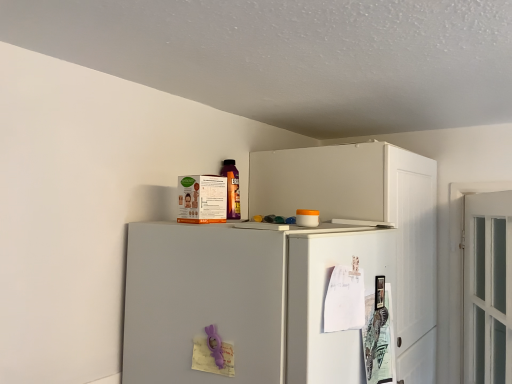
You are a GUI agent. You are given a task and a screenshot of the screen. Output one action in this format:
    pyautogui.click(x=<x>, y=<y>)
    Task: Click on the white glass door at right, which appears as the second door when viewed from the left
    This screenshot has width=512, height=384.
    Given the screenshot: What is the action you would take?
    coord(488,288)

Based on the photo, what is the approximate height of white glass door at right, the first door viewed from the right?

white glass door at right, the first door viewed from the right, is 31.31 inches tall.

This screenshot has height=384, width=512. Describe the element at coordinates (369, 222) in the screenshot. I see `white matte cabinet at upper right` at that location.

Image resolution: width=512 pixels, height=384 pixels. I want to click on white matte cabinet at upper right, so click(369, 222).

This screenshot has width=512, height=384. What do you see at coordinates (257, 302) in the screenshot?
I see `white matte refrigerator at upper center` at bounding box center [257, 302].

This screenshot has width=512, height=384. In order to click on white glass door at right, which appears as the second door when viewed from the left in this screenshot , I will do `click(488, 288)`.

Is white matte refrigerator at upper center in front of or behind white paper at upper right, the 2th door viewed from the right, in the image?

In the image, white matte refrigerator at upper center appears in front of white paper at upper right, the 2th door viewed from the right.

Based on the photo, is white matte refrigerator at upper center bigger or smaller than white paper at upper right, placed as the 1th door when sorted from left to right?

Considering their sizes, white matte refrigerator at upper center takes up more space than white paper at upper right, placed as the 1th door when sorted from left to right.

Considering the positions of objects white matte refrigerator at upper center and white paper at upper right, the 2th door viewed from the right, in the image provided, who is more to the right, white matte refrigerator at upper center or white paper at upper right, the 2th door viewed from the right,?

Positioned to the right is white paper at upper right, the 2th door viewed from the right.

From a real-world perspective, starting from the white matte refrigerator at upper center, which door is the 2nd one vertically above it? Please provide its 2D coordinates.

[(339, 307)]

From a real-world perspective, between white paper at upper right, placed as the 1th door when sorted from left to right, and white matte refrigerator at upper center, who is vertically lower?

From a 3D spatial view, white matte refrigerator at upper center is below.

Measure the distance from white paper at upper right, the 2th door viewed from the right, to white matte refrigerator at upper center.

A distance of 4.33 inches exists between white paper at upper right, the 2th door viewed from the right, and white matte refrigerator at upper center.

Is white paper at upper right, placed as the 1th door when sorted from left to right, in contact with white matte refrigerator at upper center?

No, white paper at upper right, placed as the 1th door when sorted from left to right, is not making contact with white matte refrigerator at upper center.

You are a GUI agent. You are given a task and a screenshot of the screen. Output one action in this format:
    pyautogui.click(x=<x>, y=<y>)
    Task: Click on the door behind the white paper at upper right, placed as the 1th door when sorted from left to right
    
    Given the screenshot: What is the action you would take?
    [x=488, y=288]

Considering the relative sizes of white paper at upper right, placed as the 1th door when sorted from left to right, and white glass door at right, the first door viewed from the right, in the image provided, is white paper at upper right, placed as the 1th door when sorted from left to right, wider than white glass door at right, the first door viewed from the right,?

No, white paper at upper right, placed as the 1th door when sorted from left to right, is not wider than white glass door at right, the first door viewed from the right.

Is white paper at upper right, placed as the 1th door when sorted from left to right, touching white glass door at right, the first door viewed from the right?

No, white paper at upper right, placed as the 1th door when sorted from left to right, is not beside white glass door at right, the first door viewed from the right.

Are white glass door at right, which appears as the second door when viewed from the left, and white paper at upper right, the 2th door viewed from the right, located far from each other?

white glass door at right, which appears as the second door when viewed from the left, is actually quite close to white paper at upper right, the 2th door viewed from the right.

Could you tell me if white glass door at right, the first door viewed from the right, is turned towards white paper at upper right, the 2th door viewed from the right?

No.

Which is behind, white glass door at right, the first door viewed from the right, or white paper at upper right, the 2th door viewed from the right?

white glass door at right, the first door viewed from the right.

Is white paper at upper right, placed as the 1th door when sorted from left to right, inside the boundaries of white matte cabinet at upper right, or outside?

white paper at upper right, placed as the 1th door when sorted from left to right, cannot be found inside white matte cabinet at upper right.

From the image's perspective, would you say white paper at upper right, the 2th door viewed from the right, is shown under white matte cabinet at upper right?

No, from the image's perspective, white paper at upper right, the 2th door viewed from the right, is not below white matte cabinet at upper right.

Is point (302, 354) positioned before point (344, 215)?

Yes, point (302, 354) is in front of point (344, 215).

Between white paper at upper right, the 2th door viewed from the right, and white matte cabinet at upper right, which one has smaller size?

white paper at upper right, the 2th door viewed from the right.

Would you say white matte cabinet at upper right is inside or outside white paper at upper right, placed as the 1th door when sorted from left to right?

white matte cabinet at upper right cannot be found inside white paper at upper right, placed as the 1th door when sorted from left to right.

Can you confirm if white matte cabinet at upper right is wider than white paper at upper right, the 2th door viewed from the right?

Yes.

Between white matte cabinet at upper right and white paper at upper right, the 2th door viewed from the right, which one appears on the right side from the viewer's perspective?

→ Positioned to the right is white matte cabinet at upper right.

From a real-world perspective, is white matte cabinet at upper right under white paper at upper right, placed as the 1th door when sorted from left to right?

No, from a real-world perspective, white matte cabinet at upper right is not below white paper at upper right, placed as the 1th door when sorted from left to right.

Considering the sizes of objects white glass door at right, which appears as the second door when viewed from the left, and white matte refrigerator at upper center in the image provided, who is taller, white glass door at right, which appears as the second door when viewed from the left, or white matte refrigerator at upper center?

white glass door at right, which appears as the second door when viewed from the left.

Is the depth of white glass door at right, the first door viewed from the right, greater than that of white matte refrigerator at upper center?

Yes.

Is point (469, 255) positioned before point (391, 242)?

That is False.

The height and width of the screenshot is (384, 512). I want to click on refrigerator below the white paper at upper right, placed as the 1th door when sorted from left to right (from a real-world perspective), so click(257, 302).

Where is `refrigerator that appears below the white paper at upper right, placed as the 1th door when sorted from left to right (from the image's perspective)`? refrigerator that appears below the white paper at upper right, placed as the 1th door when sorted from left to right (from the image's perspective) is located at coordinates (257, 302).

Based on the photo, based on their spatial positions, is white paper at upper right, the 2th door viewed from the right, or white glass door at right, which appears as the second door when viewed from the left, closer to white matte cabinet at upper right?

white glass door at right, which appears as the second door when viewed from the left.

Based on their spatial positions, is white matte refrigerator at upper center or white glass door at right, which appears as the second door when viewed from the left, further from white matte cabinet at upper right?

The object further to white matte cabinet at upper right is white matte refrigerator at upper center.

Considering their positions, is white matte cabinet at upper right positioned further to white matte refrigerator at upper center than white paper at upper right, the 2th door viewed from the right?

white matte cabinet at upper right.

Which object lies further to the anchor point white glass door at right, the first door viewed from the right, white matte refrigerator at upper center or white paper at upper right, placed as the 1th door when sorted from left to right?

Based on the image, white matte refrigerator at upper center appears to be further to white glass door at right, the first door viewed from the right.

Based on the photo, considering their positions, is white matte cabinet at upper right positioned further to white glass door at right, the first door viewed from the right, than white paper at upper right, placed as the 1th door when sorted from left to right?

white paper at upper right, placed as the 1th door when sorted from left to right.

Looking at the image, which one is located further to white glass door at right, which appears as the second door when viewed from the left, white matte cabinet at upper right or white matte refrigerator at upper center?

white matte refrigerator at upper center lies further to white glass door at right, which appears as the second door when viewed from the left, than the other object.

When comparing their distances from white matte refrigerator at upper center, does white glass door at right, which appears as the second door when viewed from the left, or white matte cabinet at upper right seem further?

Among the two, white glass door at right, which appears as the second door when viewed from the left, is located further to white matte refrigerator at upper center.

When comparing their distances from white matte cabinet at upper right, does white glass door at right, the first door viewed from the right, or white paper at upper right, placed as the 1th door when sorted from left to right, seem closer?

white glass door at right, the first door viewed from the right, is closer to white matte cabinet at upper right.

Locate an element on the screen. This screenshot has width=512, height=384. door between white matte refrigerator at upper center and white glass door at right, which appears as the second door when viewed from the left, from left to right is located at coordinates click(x=339, y=307).

Where is `cabinetry between white paper at upper right, the 2th door viewed from the right, and white glass door at right, which appears as the second door when viewed from the left`? cabinetry between white paper at upper right, the 2th door viewed from the right, and white glass door at right, which appears as the second door when viewed from the left is located at coordinates (369, 222).

Locate an element on the screen. cabinetry between white matte refrigerator at upper center and white glass door at right, the first door viewed from the right is located at coordinates (369, 222).